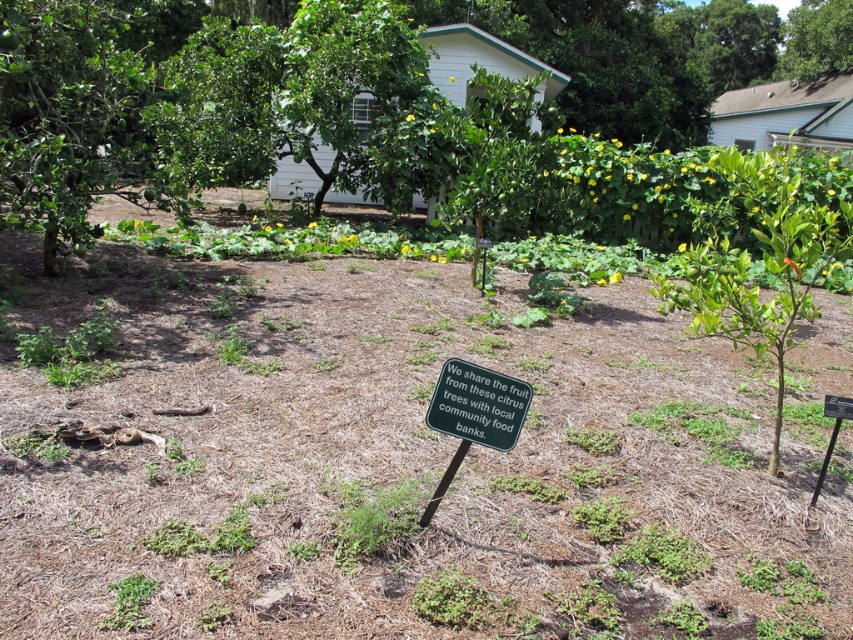
You are designing a new garden layout and need to place a bench between the green leafy tree at upper center and the green plastic sign at center. Which object should the bench be closer to if you want it to be near the wider object?

The bench should be placed closer to the green leafy tree at upper center because it might be wider than the green plastic sign at center according to the description.

You are a gardener looking at the garden scene. You need to place a new decorative stone between the green leafy tree at upper center and the green plastic sign at center. Based on their positions, which object should the stone be closer to?

The stone should be placed closer to the green plastic sign at center because the green leafy tree at upper center is to the left of the green plastic sign at center, so the sign is on the right side. Therefore, placing the stone between them would mean it is closer to the sign if it is near the center.

You are standing in the garden and want to reach a point that is exactly 40 feet away from you. Is the point at coordinates point (288, 35) within your target distance range?

The distance of point (288, 35) from viewer is 41.89 feet, which is slightly beyond the 40 feet target distance. Therefore, the point is not within the desired range.